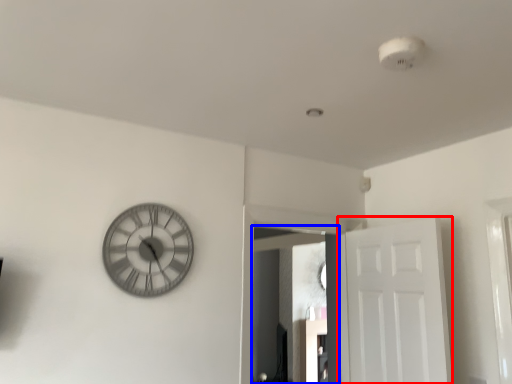
Question: Which object is closer to the camera taking this photo, door (highlighted by a red box) or mirror (highlighted by a blue box)?

Choices:
 (A) door
 (B) mirror

Answer: (A)